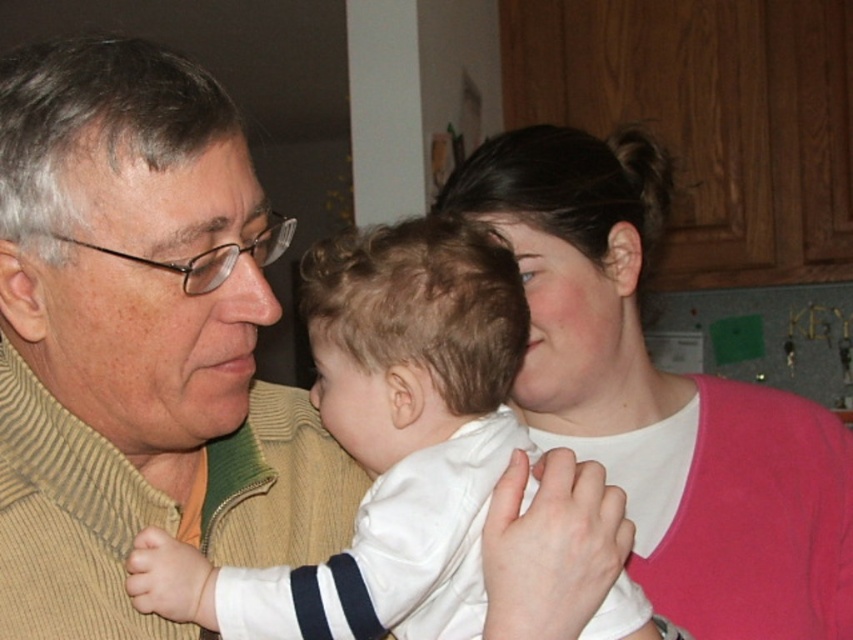
Question: Which object appears farthest from the camera in this image?

Choices:
 (A) pink matte sweater at upper right
 (B) white satin baby at center

Answer: (A)

Question: In this image, where is pink matte sweater at upper right located relative to white satin baby at center?

Choices:
 (A) below
 (B) above

Answer: (B)

Question: Among these points, which one is nearest to the camera?

Choices:
 (A) (645, 502)
 (B) (234, 614)

Answer: (B)

Question: Is pink matte sweater at upper right bigger than white satin baby at center?

Choices:
 (A) yes
 (B) no

Answer: (A)

Question: Can you confirm if pink matte sweater at upper right is positioned below white satin baby at center?

Choices:
 (A) no
 (B) yes

Answer: (A)

Question: Which point is farther to the camera?

Choices:
 (A) white satin baby at center
 (B) pink matte sweater at upper right

Answer: (B)